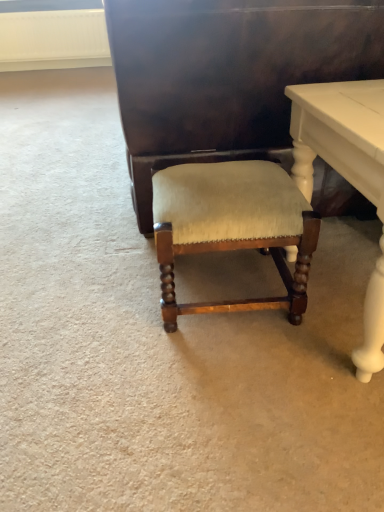
Image resolution: width=384 pixels, height=512 pixels. I want to click on free location to the left of suede-like beige cushion at center, so click(101, 294).